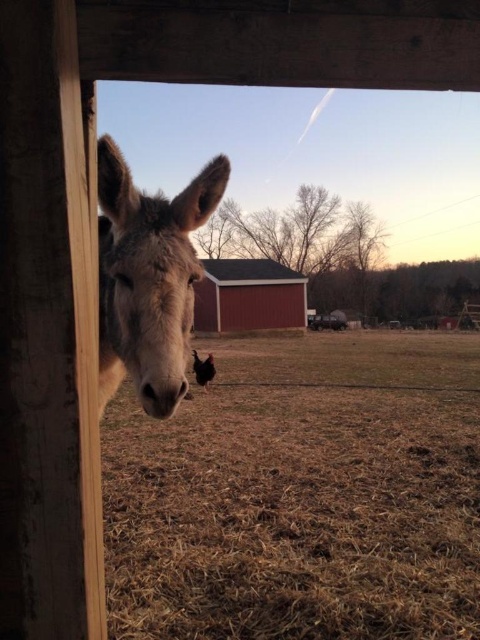
You are a farmer standing inside the wooden structure. You need to move a large bale of hay from the fuzzy gray mule at left to the red wood barn at center. Considering their sizes, will the bale fit through the space between them?

The fuzzy gray mule at left has a lesser width compared to red wood barn at center. Since the mule is narrower, the space between them should be sufficient to allow the bale of hay to pass through.

You are standing inside the wooden structure and want to exit through the door at the back. The fuzzy gray mule at left and the red wood barn at center are in your way. Which object should you move to clear the path?

The fuzzy gray mule at left is shorter than the red wood barn at center, so you should move the fuzzy gray mule at left first to clear the path.